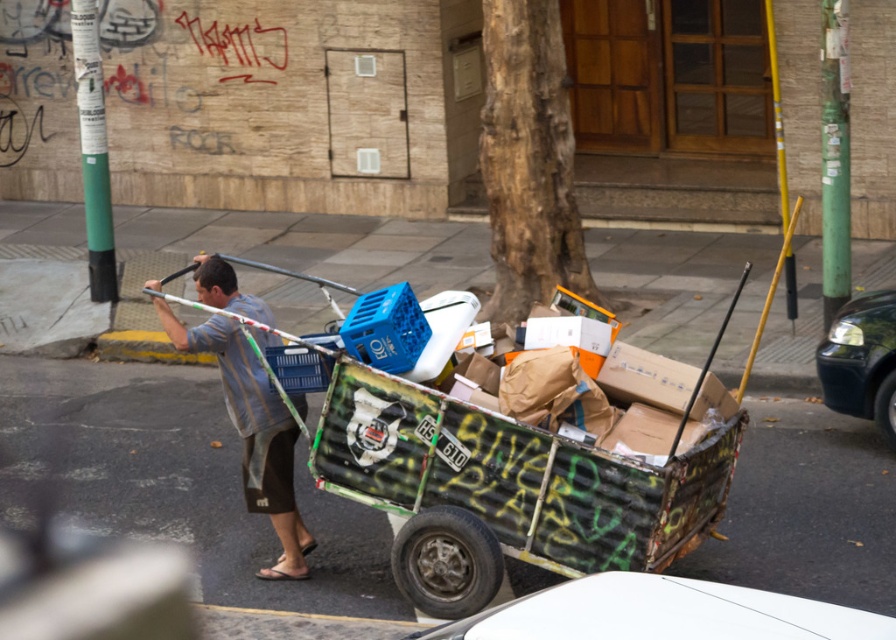
Question: Which point appears closest to the camera in this image?

Choices:
 (A) (791, 621)
 (B) (587, 496)
 (C) (877, 292)
 (D) (233, 340)

Answer: (A)

Question: Does white matte car at lower center appear under striped fabric shirt at center?

Choices:
 (A) yes
 (B) no

Answer: (A)

Question: Which point appears farthest from the camera in this image?

Choices:
 (A) pyautogui.click(x=221, y=365)
 (B) pyautogui.click(x=890, y=413)
 (C) pyautogui.click(x=228, y=316)
 (D) pyautogui.click(x=605, y=589)

Answer: (B)

Question: Is the position of white matte car at lower center more distant than that of shiny black car at right?

Choices:
 (A) yes
 (B) no

Answer: (B)

Question: Can you confirm if white matte car at lower center is wider than striped fabric shirt at center?

Choices:
 (A) no
 (B) yes

Answer: (B)

Question: Which of the following is the farthest from the observer?

Choices:
 (A) (265, 429)
 (B) (556, 564)
 (C) (547, 598)

Answer: (A)